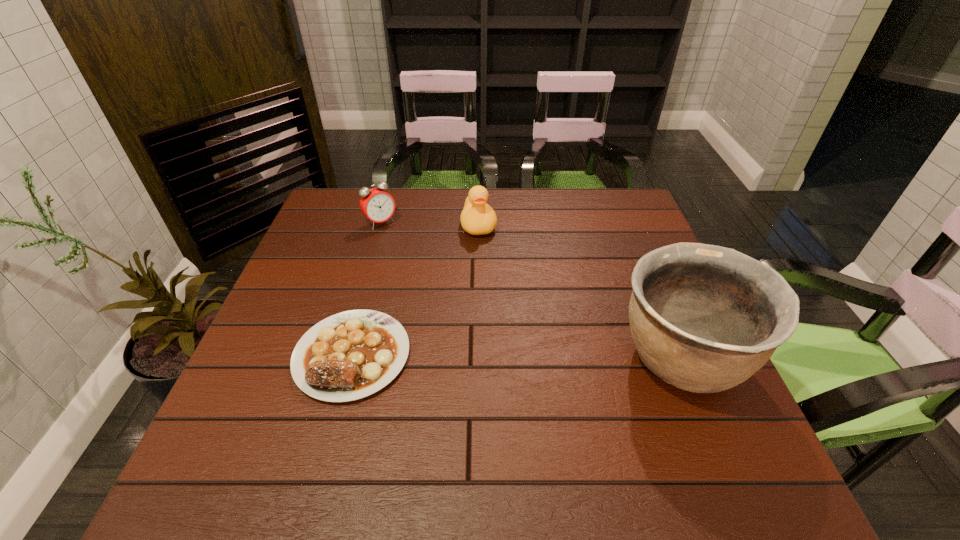
Identify the location of free space on the desktop that is between the steak and the pottery and is positioned on the face of the second object from right to left. Image resolution: width=960 pixels, height=540 pixels. (507, 357).

You are a GUI agent. You are given a task and a screenshot of the screen. Output one action in this format:
    pyautogui.click(x=<x>, y=<y>)
    Task: Click on the free space on the desktop that is between the steak and the rightmost object and is positioned on the front-facing side of the alarm clock
    
    Given the screenshot: What is the action you would take?
    pyautogui.click(x=506, y=357)